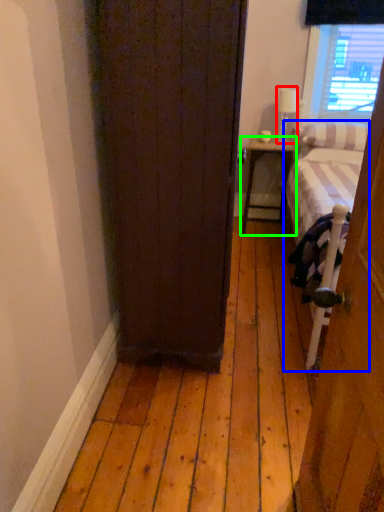
Question: Which object is the farthest from lamp (highlighted by a red box)? Choose among these: bed (highlighted by a blue box) or nightstand (highlighted by a green box).

Choices:
 (A) bed
 (B) nightstand

Answer: (A)